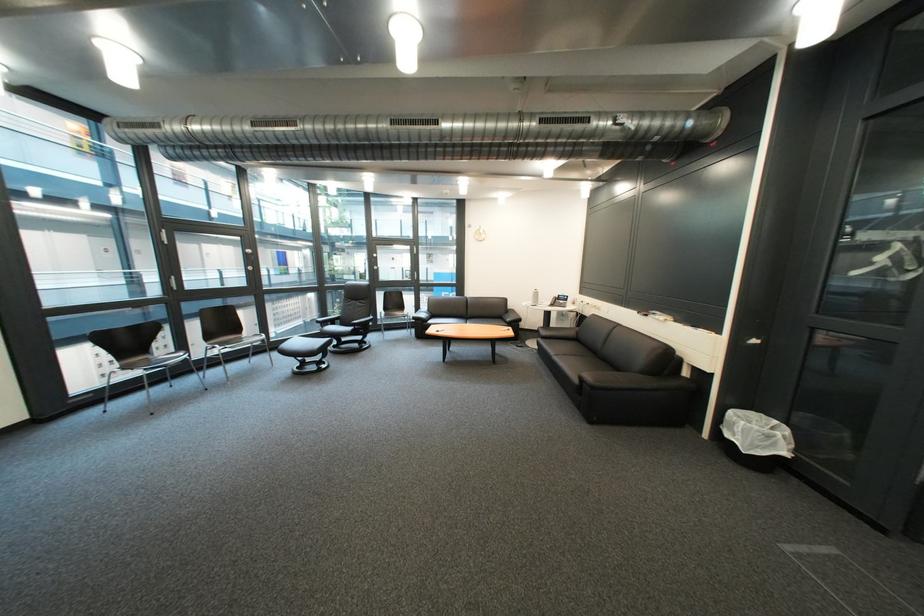
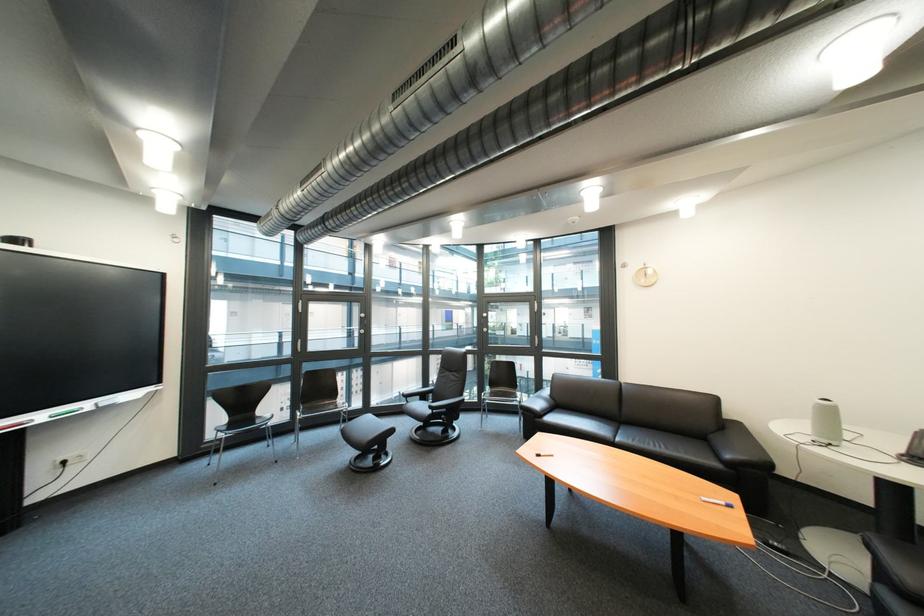
Locate, in the second image, the point that corresponds to (270,355) in the first image.

(359, 424)